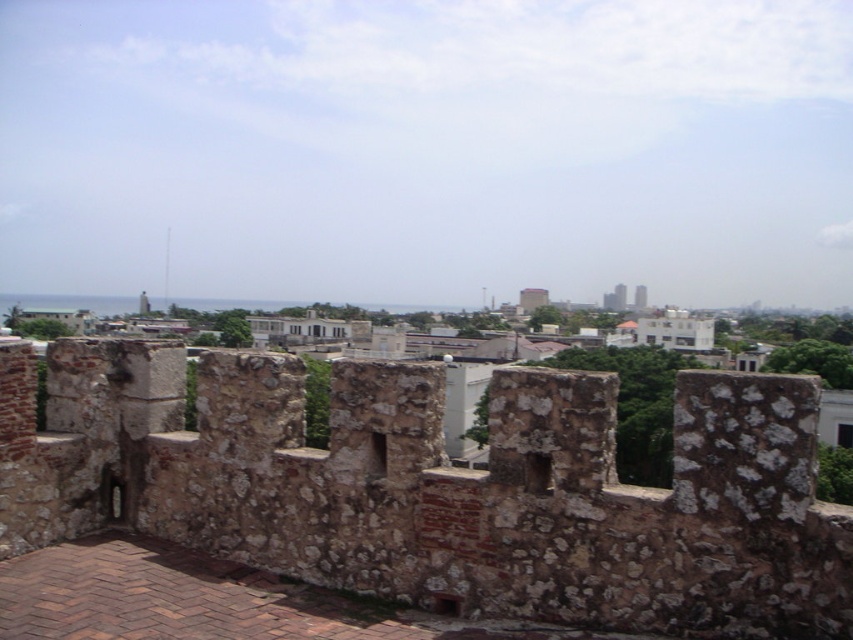
Question: Which point is farther from the camera taking this photo?

Choices:
 (A) (122, 508)
 (B) (635, 307)
 (C) (621, 305)

Answer: (B)

Question: Considering the relative positions of rustic stone wall at center and smooth concrete tower at center in the image provided, where is rustic stone wall at center located with respect to smooth concrete tower at center?

Choices:
 (A) right
 (B) left

Answer: (B)

Question: Can you confirm if rustic stone wall at center is smaller than smooth concrete tower at center?

Choices:
 (A) yes
 (B) no

Answer: (A)

Question: Does smooth concrete tower at center have a smaller size compared to white concrete tower at center?

Choices:
 (A) no
 (B) yes

Answer: (A)

Question: Which object is the closest to the rustic stone wall at center?

Choices:
 (A) smooth concrete tower at center
 (B) white concrete tower at center

Answer: (A)

Question: Which of the following is the farthest from the observer?

Choices:
 (A) smooth concrete tower at center
 (B) white concrete tower at center

Answer: (B)